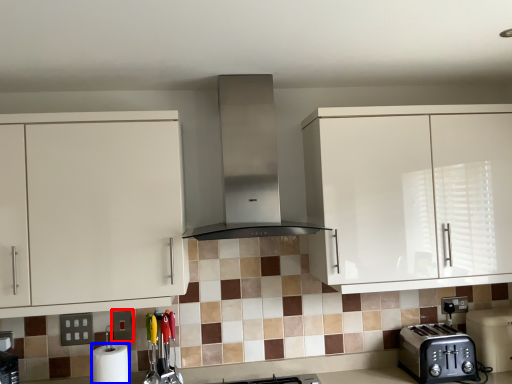
Question: Which point is closer to the camera, square (highlighted by a red box) or paper towel (highlighted by a blue box)?

Choices:
 (A) square
 (B) paper towel

Answer: (B)